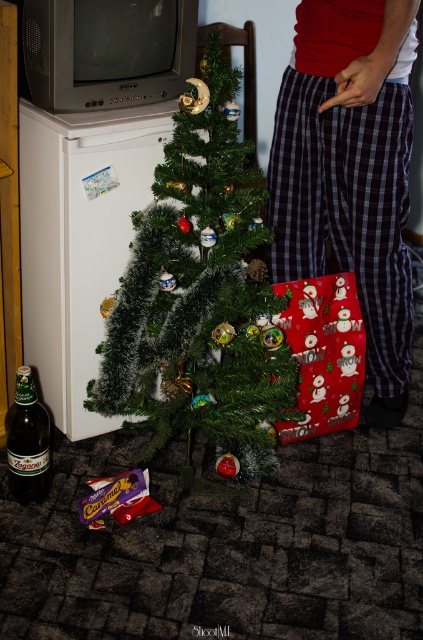
Does green matte christmas tree at center have a greater width compared to brown glass bottle at lower left?

Indeed, green matte christmas tree at center has a greater width compared to brown glass bottle at lower left.

Which is more to the right, green matte christmas tree at center or brown glass bottle at lower left?

Positioned to the right is green matte christmas tree at center.

This screenshot has width=423, height=640. What do you see at coordinates (200, 298) in the screenshot?
I see `green matte christmas tree at center` at bounding box center [200, 298].

Where is `green matte christmas tree at center`? Image resolution: width=423 pixels, height=640 pixels. green matte christmas tree at center is located at coordinates (200, 298).

Between green matte christmas tree at center and plaid cotton pants at center, which one is positioned lower?

green matte christmas tree at center is below.

Measure the distance between point (291, 358) and camera.

6.16 feet

Consider the image. Who is more distant from viewer, (200, 422) or (360, 40)?

The point (200, 422) is behind.

Image resolution: width=423 pixels, height=640 pixels. Identify the location of green matte christmas tree at center. (200, 298).

Between point (291, 200) and point (19, 444), which one is positioned behind?

The point (291, 200) is behind.

Which is behind, point (395, 173) or point (44, 490)?

The point (44, 490) is behind.

Locate an element on the screen. The width and height of the screenshot is (423, 640). plaid cotton pants at center is located at coordinates pos(349,172).